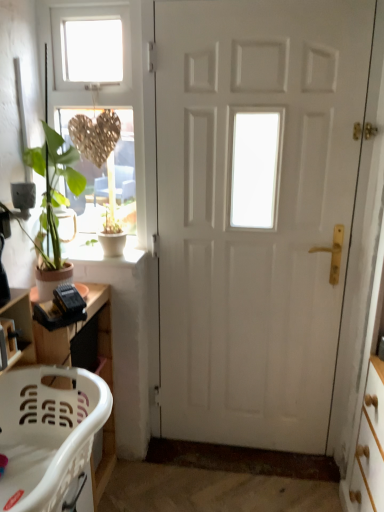
Question: Can you confirm if white matte door at center is taller than white concrete window sill at lower left?

Choices:
 (A) yes
 (B) no

Answer: (A)

Question: Is white matte door at center thinner than white concrete window sill at lower left?

Choices:
 (A) no
 (B) yes

Answer: (B)

Question: Considering the relative sizes of white matte door at center and white concrete window sill at lower left in the image provided, is white matte door at center smaller than white concrete window sill at lower left?

Choices:
 (A) yes
 (B) no

Answer: (B)

Question: Are white matte door at center and white concrete window sill at lower left far apart?

Choices:
 (A) yes
 (B) no

Answer: (B)

Question: From a real-world perspective, is white matte door at center below white concrete window sill at lower left?

Choices:
 (A) no
 (B) yes

Answer: (A)

Question: From the image's perspective, is wooden shelf at lower left located above or below matte gold heart at upper left?

Choices:
 (A) below
 (B) above

Answer: (A)

Question: Considering the positions of wooden shelf at lower left and matte gold heart at upper left in the image, is wooden shelf at lower left taller or shorter than matte gold heart at upper left?

Choices:
 (A) short
 (B) tall

Answer: (A)

Question: In terms of size, does wooden shelf at lower left appear bigger or smaller than matte gold heart at upper left?

Choices:
 (A) small
 (B) big

Answer: (A)

Question: Would you say wooden shelf at lower left is to the left or to the right of matte gold heart at upper left in the picture?

Choices:
 (A) left
 (B) right

Answer: (A)

Question: Relative to white plastic laundry basket at lower left, is white concrete window sill at lower left in front or behind?

Choices:
 (A) behind
 (B) front

Answer: (A)

Question: Choose the correct answer: Is white concrete window sill at lower left inside white plastic laundry basket at lower left or outside it?

Choices:
 (A) inside
 (B) outside

Answer: (B)

Question: Considering the positions of white concrete window sill at lower left and white plastic laundry basket at lower left in the image, is white concrete window sill at lower left bigger or smaller than white plastic laundry basket at lower left?

Choices:
 (A) big
 (B) small

Answer: (B)

Question: From the image's perspective, is white concrete window sill at lower left positioned above or below white plastic laundry basket at lower left?

Choices:
 (A) below
 (B) above

Answer: (B)

Question: Is matte gold heart at upper left spatially inside white concrete window sill at lower left, or outside of it?

Choices:
 (A) inside
 (B) outside

Answer: (B)

Question: From the image's perspective, relative to white concrete window sill at lower left, is matte gold heart at upper left above or below?

Choices:
 (A) below
 (B) above

Answer: (B)